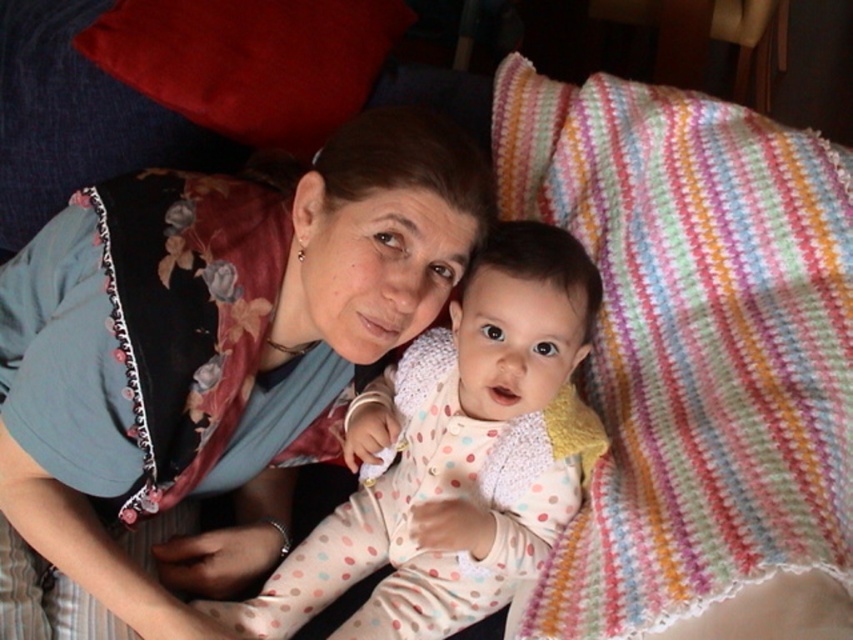
What do you see at coordinates (456, 456) in the screenshot?
I see `polka dot fabric baby at center` at bounding box center [456, 456].

Measure the distance between point (448, 349) and camera.

The distance of point (448, 349) from camera is 3.84 feet.

This screenshot has height=640, width=853. In order to click on polka dot fabric baby at center in this screenshot , I will do `click(456, 456)`.

The height and width of the screenshot is (640, 853). I want to click on polka dot fabric baby at center, so click(456, 456).

Can you confirm if matte blue shirt at center is positioned to the right of polka dot fabric baby at center?

In fact, matte blue shirt at center is to the left of polka dot fabric baby at center.

Which is behind, point (137, 403) or point (469, 429)?

The point (469, 429) is behind.

This screenshot has width=853, height=640. I want to click on matte blue shirt at center, so click(x=207, y=362).

Which is above, matte blue shirt at center or multicolored knitted blanket at upper right?

multicolored knitted blanket at upper right

Who is taller, matte blue shirt at center or multicolored knitted blanket at upper right?

multicolored knitted blanket at upper right is taller.

Identify the location of matte blue shirt at center. The image size is (853, 640). (207, 362).